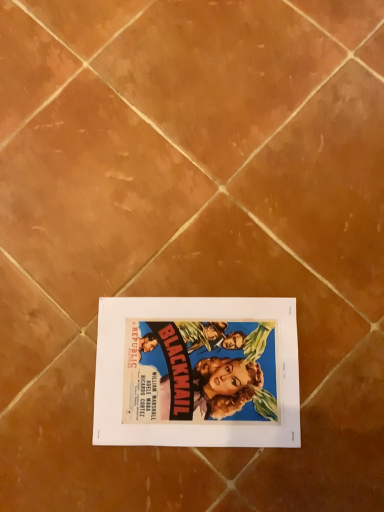
Identify the location of free space above white paper at center (from a real-world perspective). This screenshot has height=512, width=384. (190, 367).